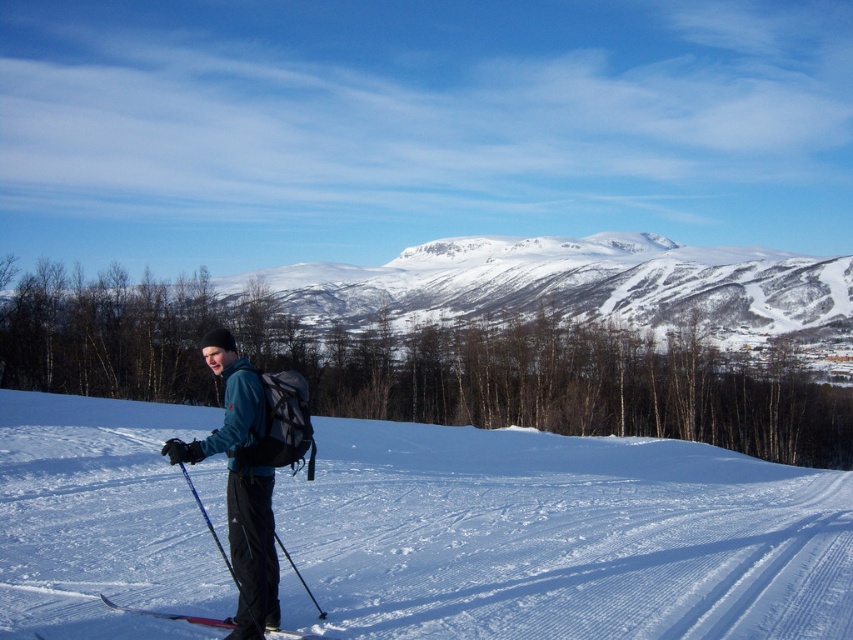
Is white powder snow at center shorter than snowy mountain at center?

Yes.

Between point (96, 467) and point (749, 314), which one is positioned behind?

The point (749, 314) is more distant.

Between point (33, 433) and point (495, 298), which one is positioned behind?

The point (495, 298) is more distant.

Find the location of a particular element. white powder snow at center is located at coordinates (560, 538).

Can you confirm if white powder snow at center is shorter than matte blue jacket at center?

No.

Between white powder snow at center and matte blue jacket at center, which one appears on the right side from the viewer's perspective?

matte blue jacket at center

Who is more forward, (193, 554) or (225, 332)?

Point (225, 332)

Find the location of `white powder snow at center`. white powder snow at center is located at coordinates (560, 538).

Who is more forward, (250, 388) or (279, 630)?

Positioned in front is point (250, 388).

Which of these two, matte blue jacket at center or metallic skis at lower center, stands taller?

With more height is matte blue jacket at center.

The height and width of the screenshot is (640, 853). Describe the element at coordinates (241, 484) in the screenshot. I see `matte blue jacket at center` at that location.

At what (x,y) coordinates should I click in order to perform the action: click on matte blue jacket at center. Please return your answer as a coordinate pair (x, y). Looking at the image, I should click on (241, 484).